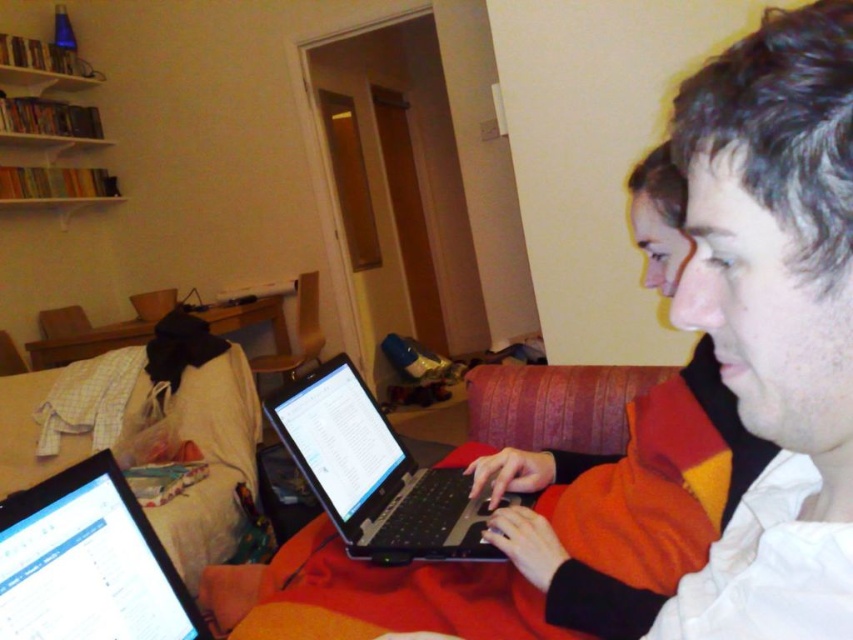
Question: Which object appears farthest from the camera in this image?

Choices:
 (A) black glossy laptop at lower left
 (B) matte black laptop at center
 (C) velvet-like orange couch at center

Answer: (C)

Question: Which of the following is the farthest from the observer?

Choices:
 (A) (83, 552)
 (B) (287, 598)
 (C) (344, 435)

Answer: (C)

Question: Is velvet-like orange couch at center above black plastic laptop at center?

Choices:
 (A) no
 (B) yes

Answer: (A)

Question: Does matte black laptop at center have a smaller size compared to black glossy laptop at lower left?

Choices:
 (A) yes
 (B) no

Answer: (B)

Question: Can you confirm if black glossy laptop at lower left is positioned to the left of white wooden bookshelf at upper left?

Choices:
 (A) yes
 (B) no

Answer: (B)

Question: Estimate the real-world distances between objects in this image. Which object is closer to the white wooden bookshelf at upper left?

Choices:
 (A) velvet-like orange couch at center
 (B) black glossy laptop at lower left

Answer: (A)